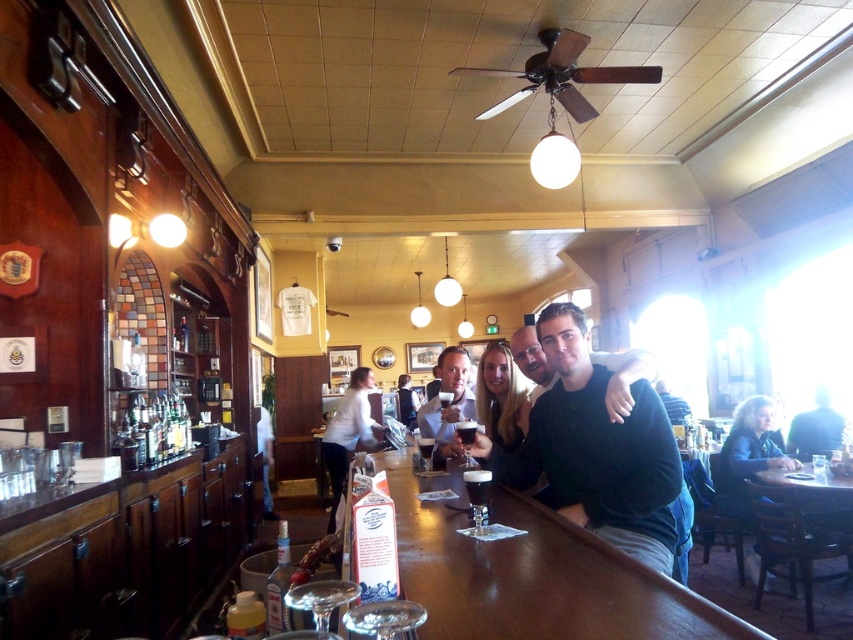
Question: Among these objects, which one is nearest to the camera?

Choices:
 (A) clear glass wine glass at bar center
 (B) clear glass wine glass at bar
 (C) clear glass wine glass at bar counter

Answer: (B)

Question: In this image, where is black sweater at bar located relative to clear glass wine glass at bar front?

Choices:
 (A) right
 (B) left

Answer: (A)

Question: Which point is farther to the camera?

Choices:
 (A) dark blue shirt at right
 (B) clear glass wine glass at bar counter

Answer: (A)

Question: Among these points, which one is nearest to the camera?

Choices:
 (A) (380, 429)
 (B) (613, 422)
 (C) (421, 458)
 (D) (306, 589)

Answer: (D)

Question: Can you confirm if clear glass wine glass at bar is smaller than dark brown glass at bar?

Choices:
 (A) no
 (B) yes

Answer: (A)

Question: Can you confirm if matte black shirt at center is bigger than clear glass wine glass at bar front?

Choices:
 (A) yes
 (B) no

Answer: (A)